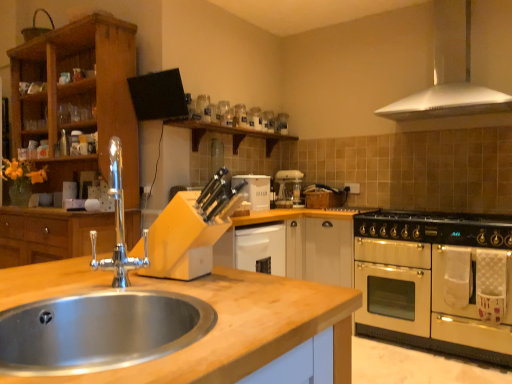
Question: From a real-world perspective, is cream matte oven at right physically below stainless steel sink at lower left?

Choices:
 (A) no
 (B) yes

Answer: (B)

Question: From the image's perspective, would you say cream matte oven at right is positioned over stainless steel sink at lower left?

Choices:
 (A) yes
 (B) no

Answer: (B)

Question: Can you confirm if cream matte oven at right is wider than stainless steel sink at lower left?

Choices:
 (A) yes
 (B) no

Answer: (A)

Question: Is cream matte oven at right taller than stainless steel sink at lower left?

Choices:
 (A) yes
 (B) no

Answer: (A)

Question: Is cream matte oven at right not close to stainless steel sink at lower left?

Choices:
 (A) no
 (B) yes

Answer: (B)

Question: Is cream matte oven at right further to the viewer compared to stainless steel sink at lower left?

Choices:
 (A) no
 (B) yes

Answer: (B)

Question: From a real-world perspective, does white plastic coffee machine at center stand above white matte bread bin at center?

Choices:
 (A) no
 (B) yes

Answer: (B)

Question: Does white plastic coffee machine at center come in front of white matte bread bin at center?

Choices:
 (A) yes
 (B) no

Answer: (B)

Question: Does white plastic coffee machine at center have a smaller size compared to white matte bread bin at center?

Choices:
 (A) no
 (B) yes

Answer: (B)

Question: From a real-world perspective, is white plastic coffee machine at center located beneath white matte bread bin at center?

Choices:
 (A) no
 (B) yes

Answer: (A)

Question: Can you confirm if white plastic coffee machine at center is wider than white matte bread bin at center?

Choices:
 (A) yes
 (B) no

Answer: (B)

Question: Is white plastic coffee machine at center outside of white matte bread bin at center?

Choices:
 (A) no
 (B) yes

Answer: (B)

Question: Is white matte bread bin at center not near white plastic coffee machine at center?

Choices:
 (A) yes
 (B) no

Answer: (B)